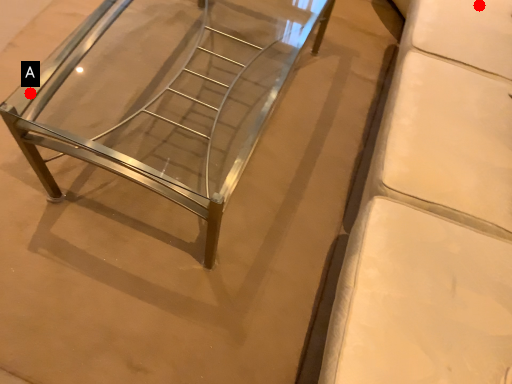
Question: Two points are circled on the image, labeled by A and B beside each circle. Among these points, which one is nearest to the camera?

Choices:
 (A) A is closer
 (B) B is closer

Answer: (A)